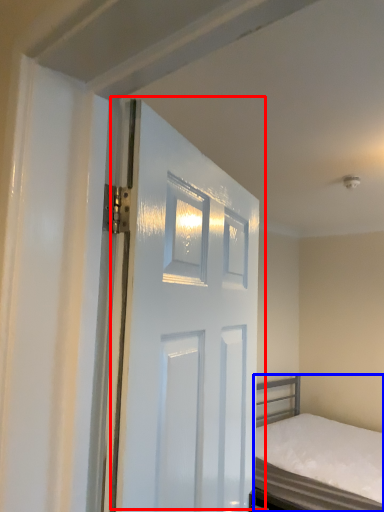
Question: Which object is further to the camera taking this photo, door (highlighted by a red box) or bed (highlighted by a blue box)?

Choices:
 (A) door
 (B) bed

Answer: (B)